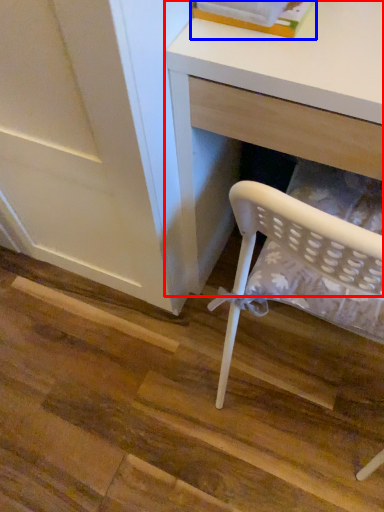
Question: Among these objects, which one is farthest to the camera, desk (highlighted by a red box) or book (highlighted by a blue box)?

Choices:
 (A) desk
 (B) book

Answer: (B)